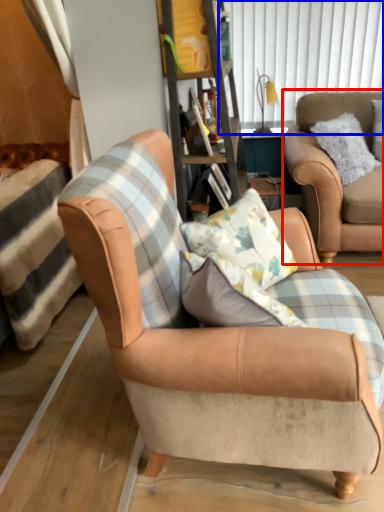
Question: Which object is closer to the camera taking this photo, chair (highlighted by a red box) or window screen (highlighted by a blue box)?

Choices:
 (A) chair
 (B) window screen

Answer: (A)